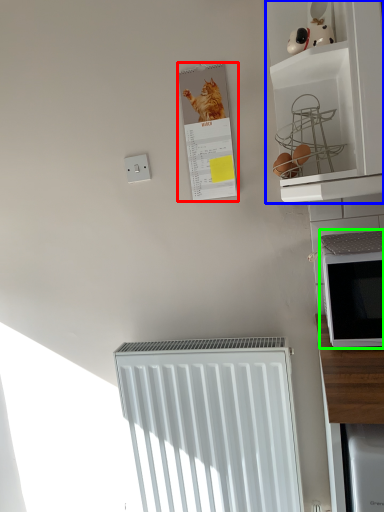
Question: Which is farther away from bulletin board (highlighted by a red box)? shelf (highlighted by a blue box) or microwave oven (highlighted by a green box)?

Choices:
 (A) shelf
 (B) microwave oven

Answer: (B)